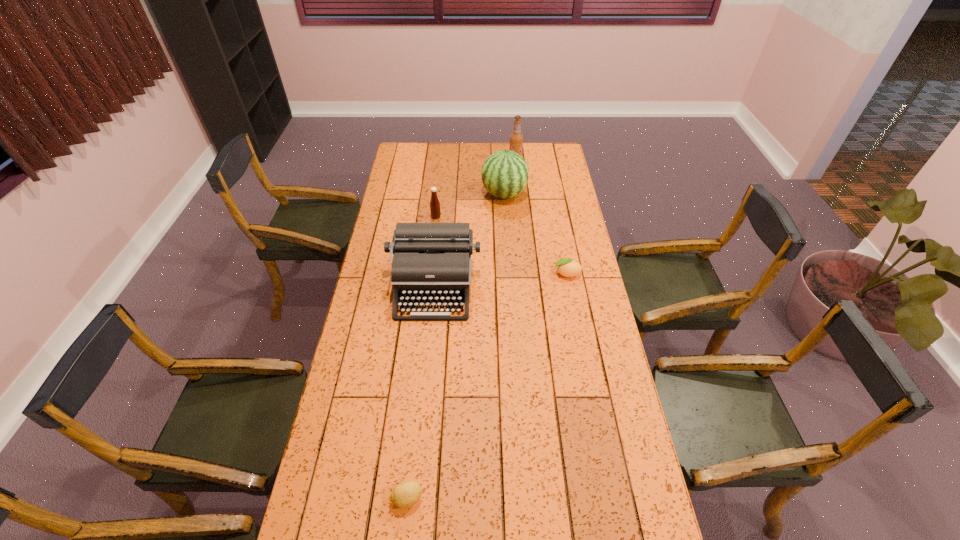
Find the location of a particular element. beer bottle is located at coordinates point(516,138).

Image resolution: width=960 pixels, height=540 pixels. What are the coordinates of `watermelon` in the screenshot? It's located at (505, 173).

Find the location of a particular element. the third tallest object is located at coordinates click(x=431, y=261).

The width and height of the screenshot is (960, 540). I want to click on the fourth nearest object, so click(x=435, y=211).

Image resolution: width=960 pixels, height=540 pixels. Identify the location of the third shortest object. (435, 211).

Find the location of a particular element. The height and width of the screenshot is (540, 960). the taller lemon is located at coordinates (567, 267).

You are a GUI agent. You are given a task and a screenshot of the screen. Output one action in this format:
    pyautogui.click(x=<x>, y=<y>)
    Task: Click on the fifth tallest object
    
    Given the screenshot: What is the action you would take?
    pos(567,267)

This screenshot has width=960, height=540. In order to click on the shorter lemon in this screenshot , I will do `click(407, 493)`.

I want to click on the nearer lemon, so click(407, 493).

Image resolution: width=960 pixels, height=540 pixels. I want to click on vacant region located on the front label of the farthest object, so click(470, 160).